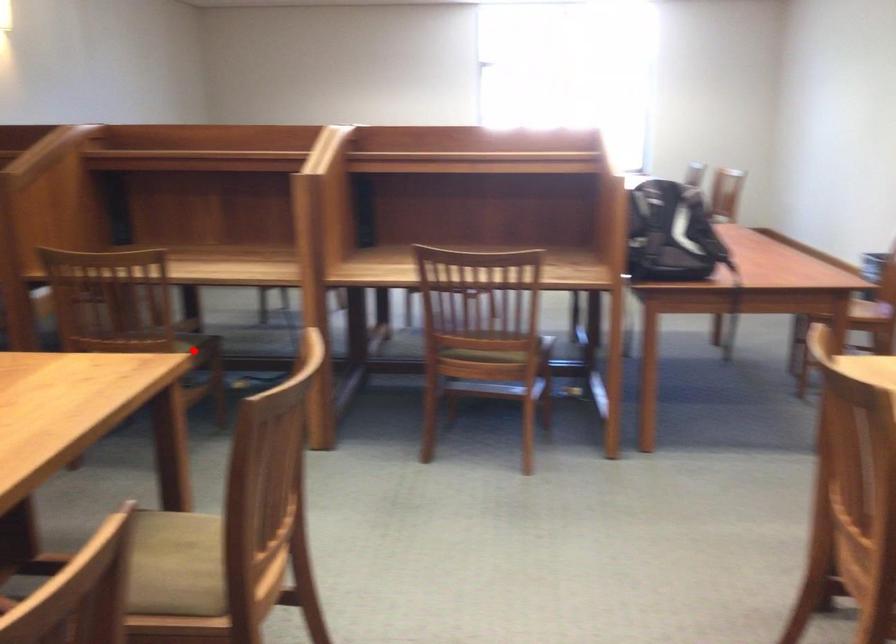
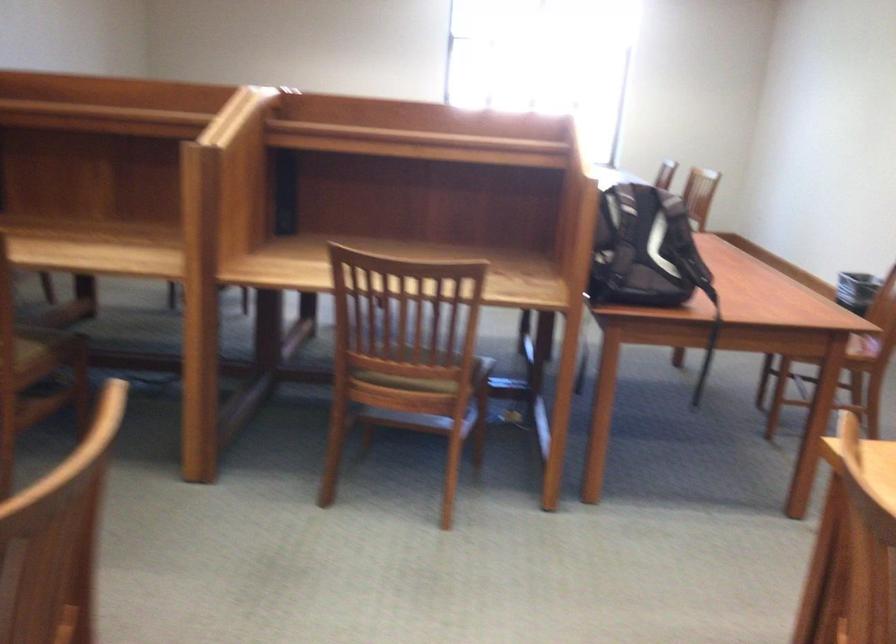
The point at the highlighted location is marked in the first image. Where is the corresponding point in the second image?

(46, 348)